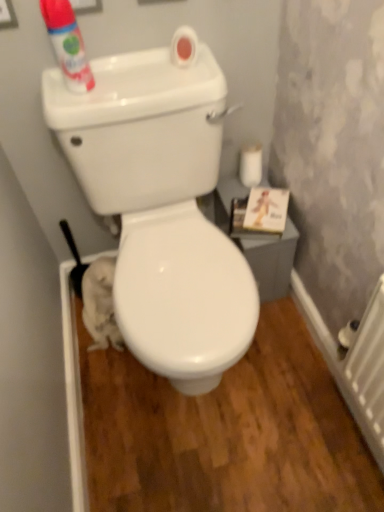
Where is `vacant space in front of white glossy toilet at center`? vacant space in front of white glossy toilet at center is located at coordinates (216, 442).